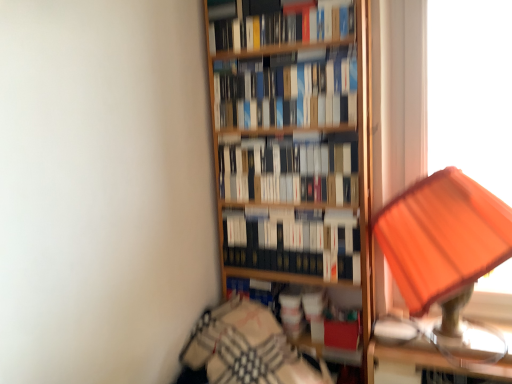
Locate an element on the screen. This screenshot has height=384, width=512. free space above hardcover books at center, marked as the fourth book in a top-to-bottom arrangement (from a real-world perspective) is located at coordinates (282, 206).